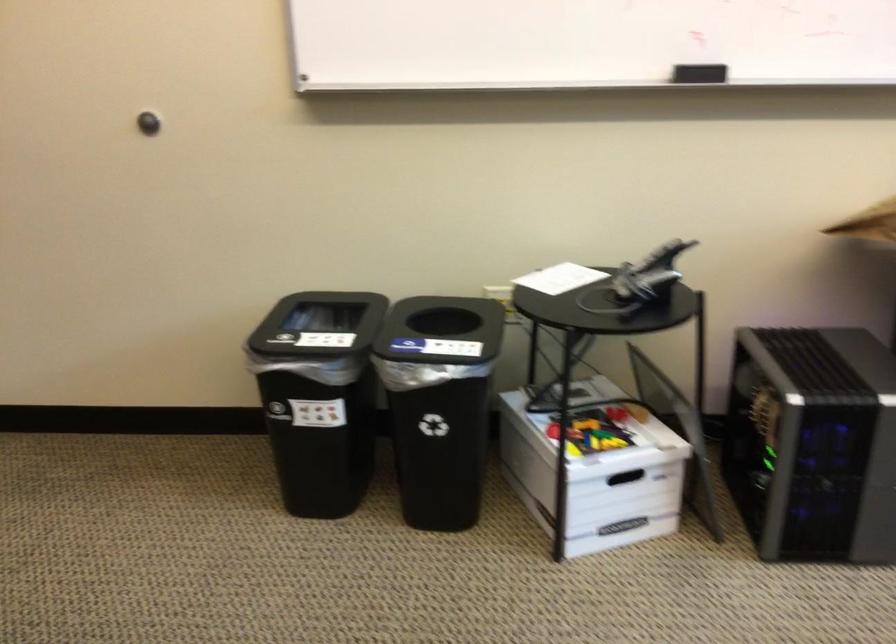
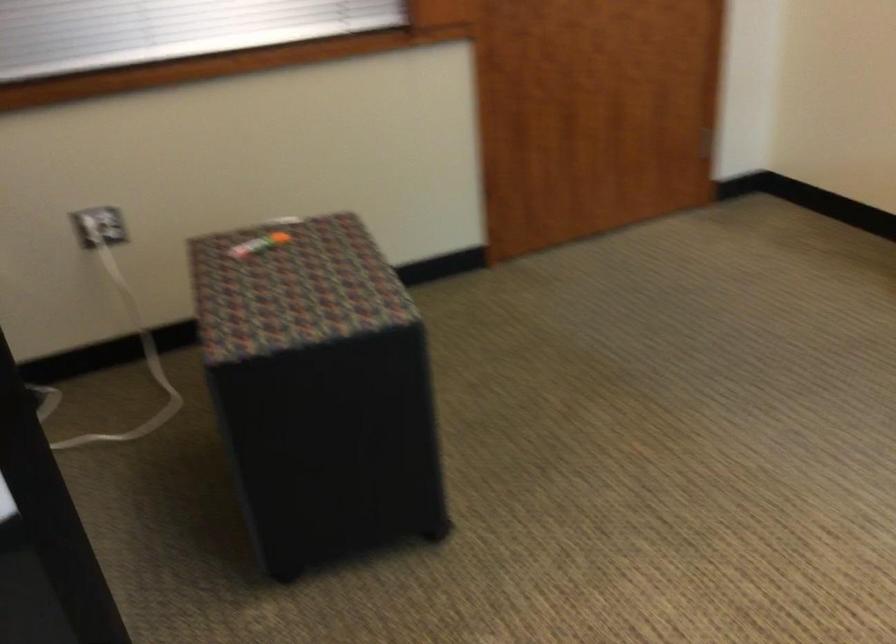
First-person continuous shooting, in which direction is the camera rotating?

The camera rotated toward left-down.